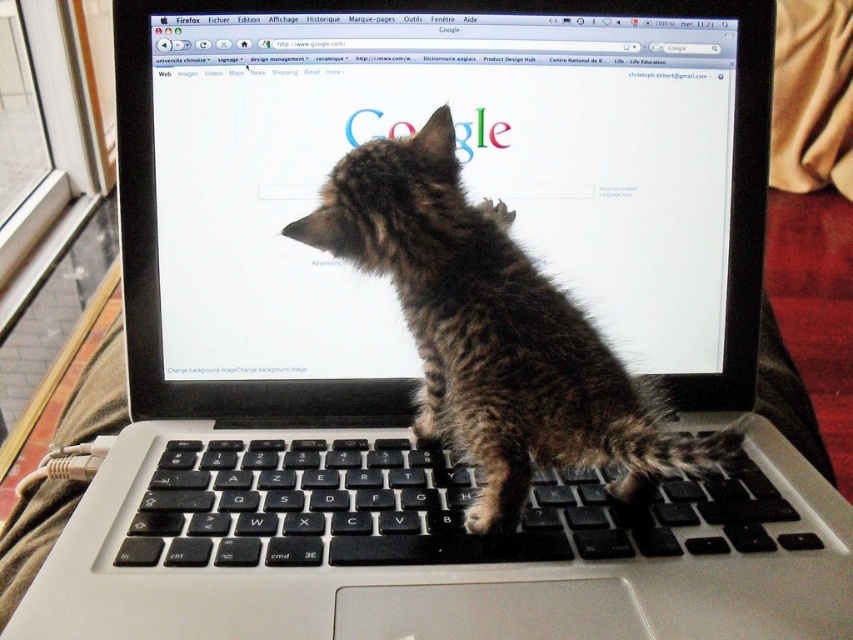
You are a delivery robot that needs to place a small package between the matte black laptop at center and the brown fur kitten at center. Can you fit the package in the space between them if the package measures 15 centimeters in length?

The distance between the matte black laptop at center and the brown fur kitten at center is 13.31 centimeters. Since the package is 15 centimeters long, which is longer than the available space, the package cannot fit between them.

You are trying to type a message on the matte black laptop at center while the brown fur kitten at center is on the keyboard. Can you type without moving the kitten?

The matte black laptop at center is further to the viewer than brown fur kitten at center, so the kitten is blocking the keyboard. You need to move the kitten to type.